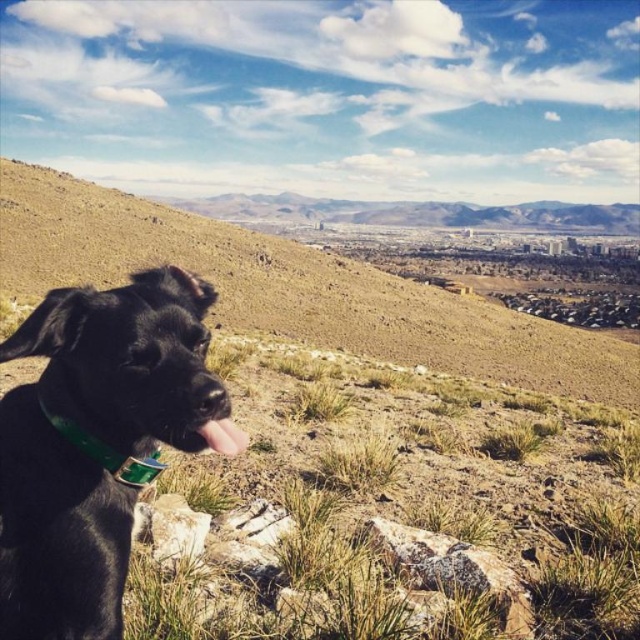
Question: Does shiny black dog at lower left appear under brown grassy hillside at lower left?

Choices:
 (A) no
 (B) yes

Answer: (B)

Question: Does shiny black dog at lower left have a larger size compared to brown grassy hillside at lower left?

Choices:
 (A) no
 (B) yes

Answer: (A)

Question: Among these points, which one is farthest from the camera?

Choices:
 (A) (352, 307)
 (B) (148, 480)

Answer: (A)

Question: Is shiny black dog at lower left closer to the viewer compared to brown grassy hillside at lower left?

Choices:
 (A) no
 (B) yes

Answer: (B)